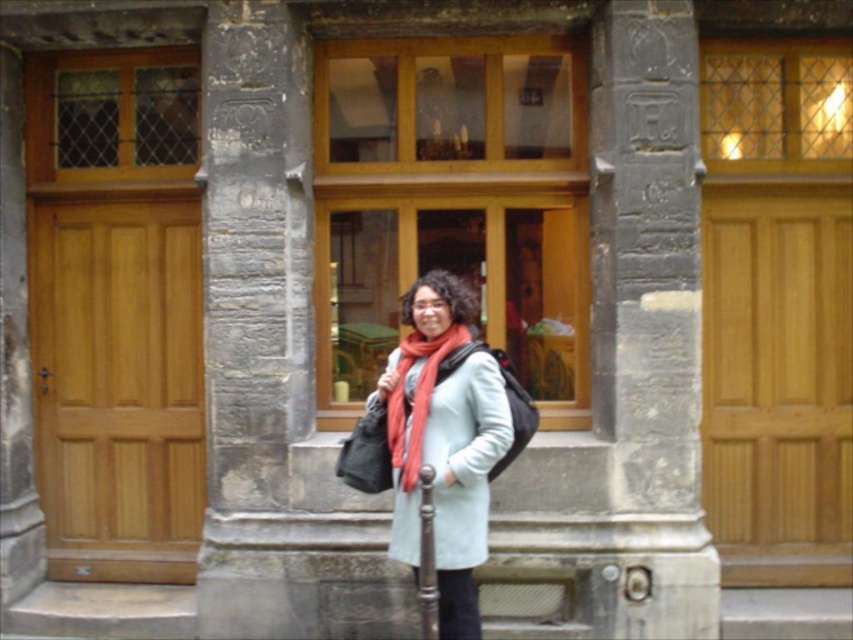
Please provide the coordinates of the light brown wood door at left in the image. The coordinates should be in the format of a point with two decimal places, such as 0.500, 0.500.

The coordinates of the light brown wood door at left are at point (x=119, y=385).

You are a visitor at the historic building and want to take a photo of the light brown wood door at left and the matte red scarf at center. Which object should you focus on first if you want to capture both in one frame without moving the camera?

The light brown wood door at left is below the matte red scarf at center, so you should focus on the door first to ensure both are in frame without moving the camera.